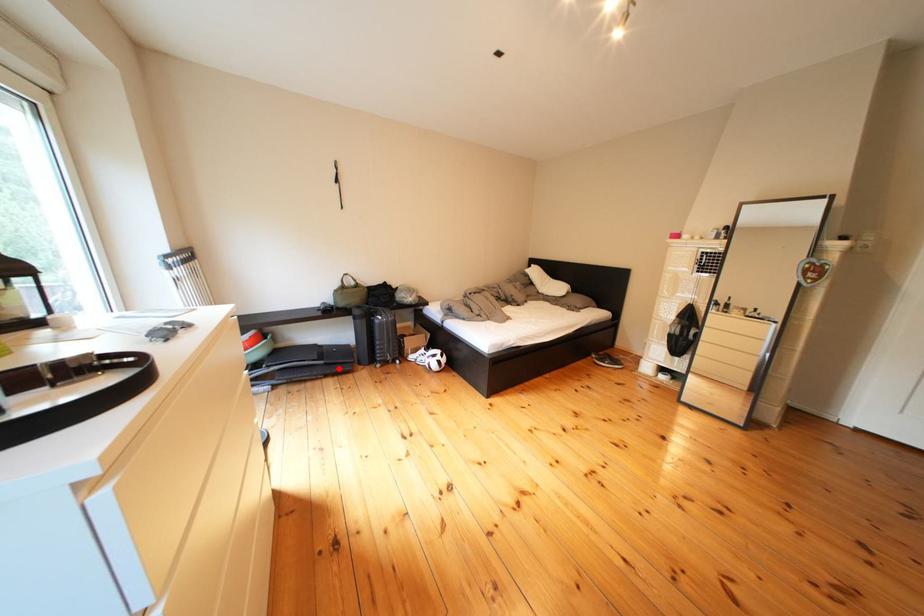
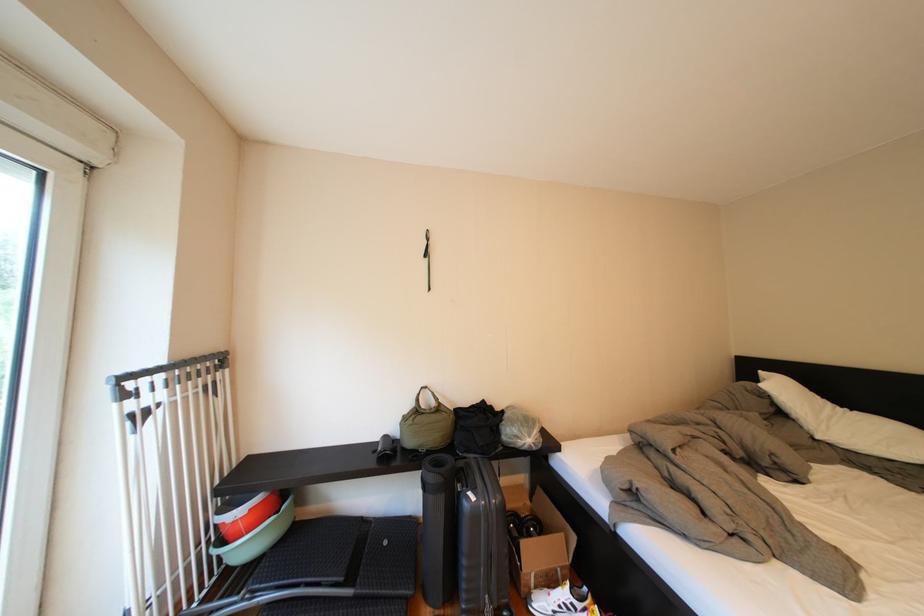
Question: A red point is marked in image1. In image2, is the corresponding 3D point closer to the camera or farther? Reply with the corresponding letter.

Choices:
 (A) The corresponding 3D point is closer.
 (B) The corresponding 3D point is farther.

Answer: (B)